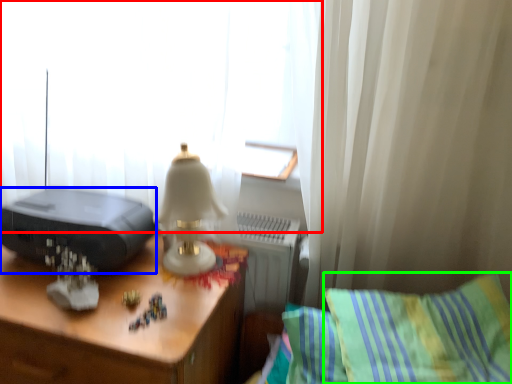
Question: Which is farther away from curtain (highlighted by a red box)? printer (highlighted by a blue box) or pillow (highlighted by a green box)?

Choices:
 (A) printer
 (B) pillow

Answer: (B)